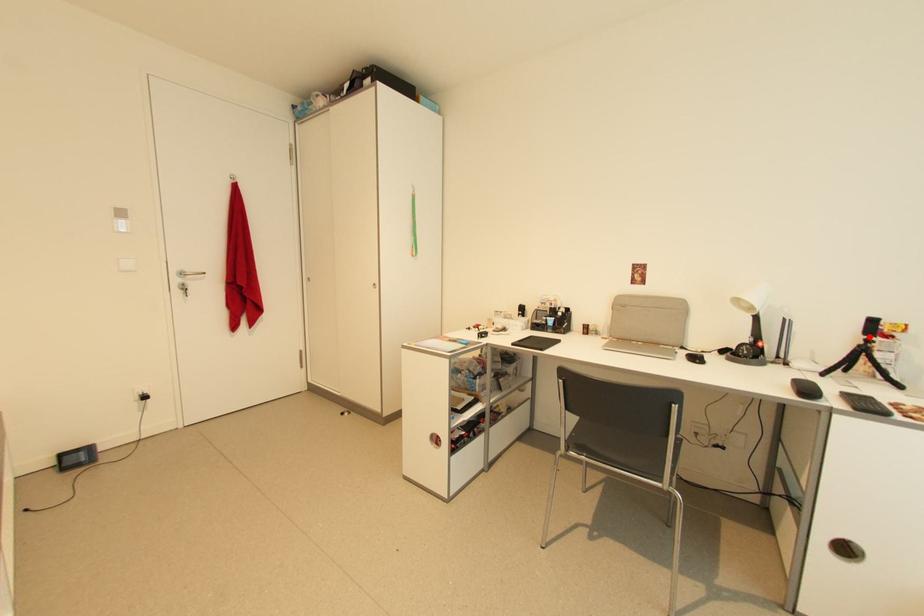
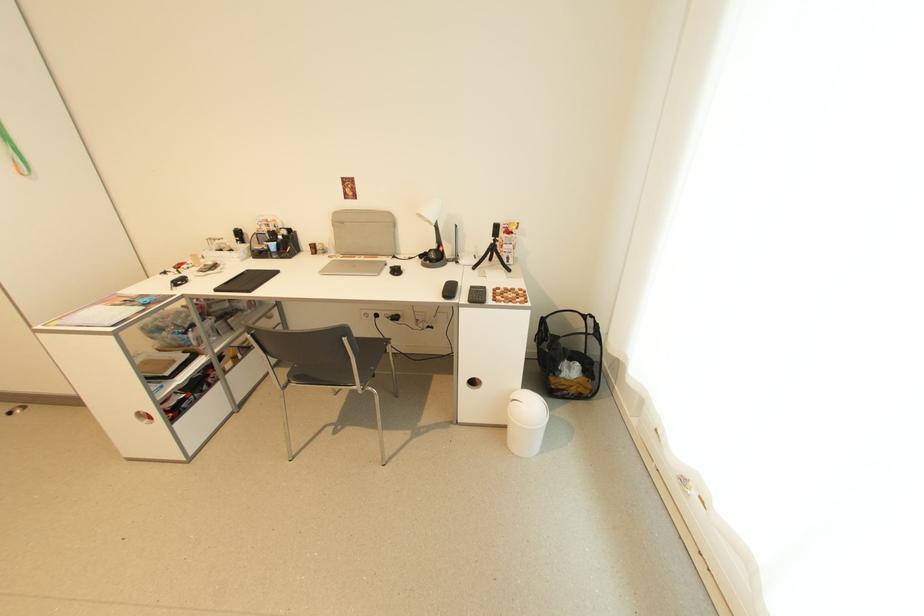
Find the pixel in the second image that matches the highlighted location in the first image.

(497, 238)